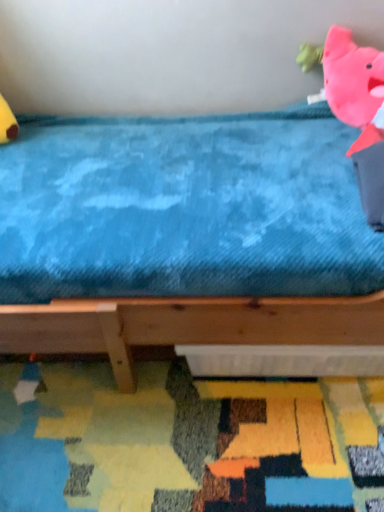
You are a GUI agent. You are given a task and a screenshot of the screen. Output one action in this format:
    pyautogui.click(x=<x>, y=<y>)
    Task: Click on the blank space above textured multicolored mat at lower center (from a real-world perspective)
    This screenshot has height=512, width=384.
    Given the screenshot: What is the action you would take?
    pyautogui.click(x=185, y=426)